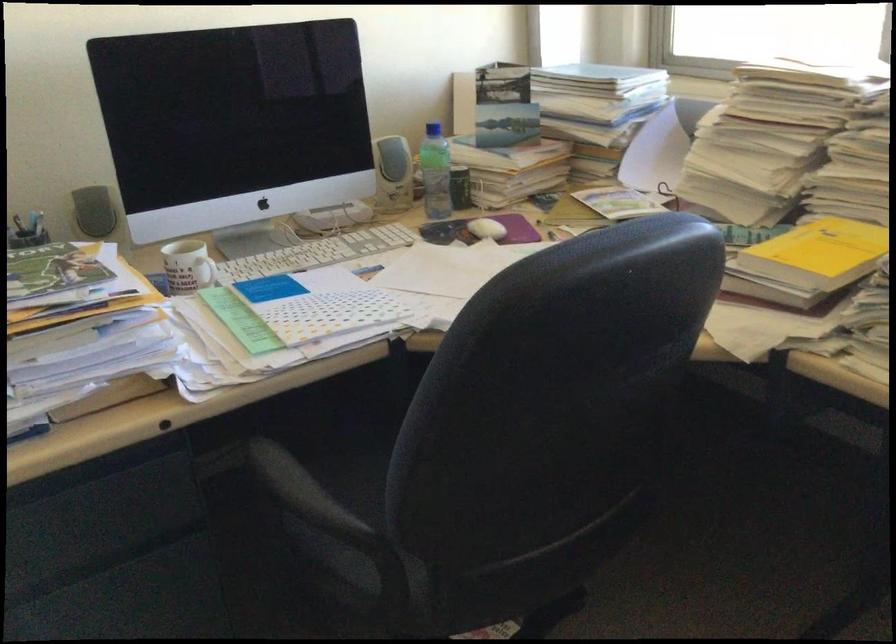
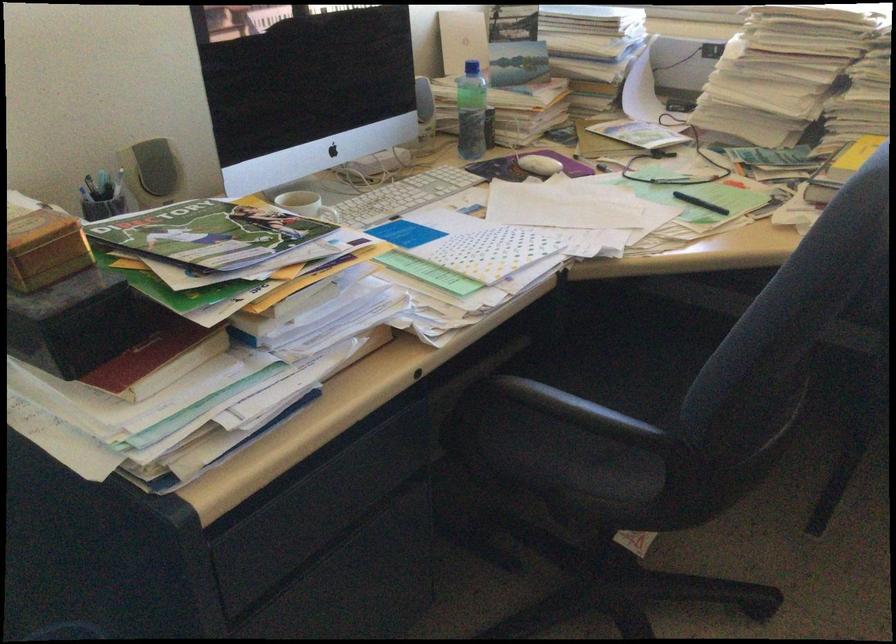
The point at (472, 230) is marked in the first image. Where is the corresponding point in the second image?

(538, 165)